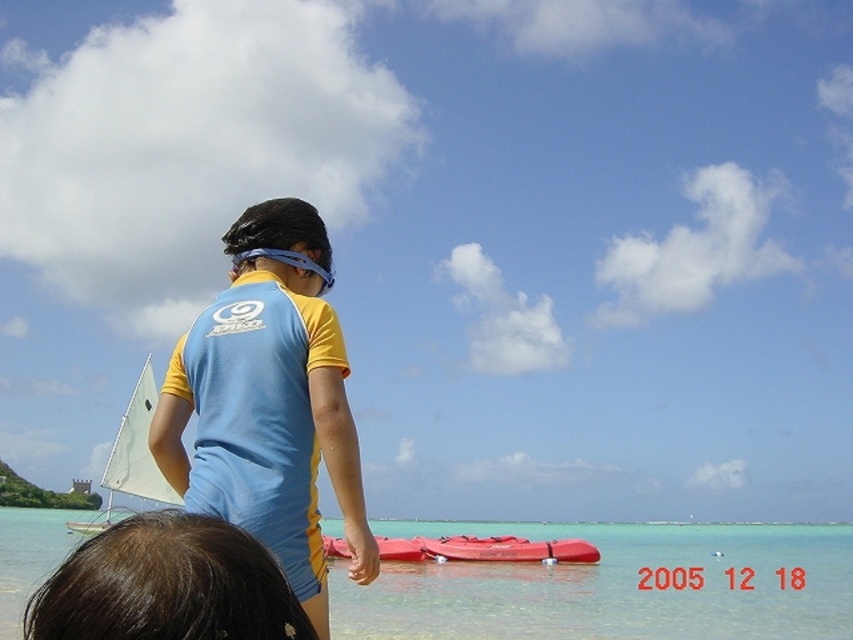
Question: Which point appears farthest from the camera in this image?

Choices:
 (A) (254, 410)
 (B) (302, 266)

Answer: (B)

Question: Which is nearer to the clear water at lower center?

Choices:
 (A) white matte sail at upper left
 (B) blue rubber goggles at upper center

Answer: (A)

Question: Which object is farther from the camera taking this photo?

Choices:
 (A) clear water at lower center
 (B) blue/yellow rash guard at center
 (C) rubberized red kayak at center

Answer: (C)

Question: Is clear water at lower center thinner than red rubber kayak at center?

Choices:
 (A) yes
 (B) no

Answer: (B)

Question: Observing the image, what is the correct spatial positioning of clear water at lower center in reference to blue rubber goggles at upper center?

Choices:
 (A) below
 (B) above

Answer: (A)

Question: In this image, where is brown smooth hair at lower left located relative to blue rubber goggles at upper center?

Choices:
 (A) below
 (B) above

Answer: (A)